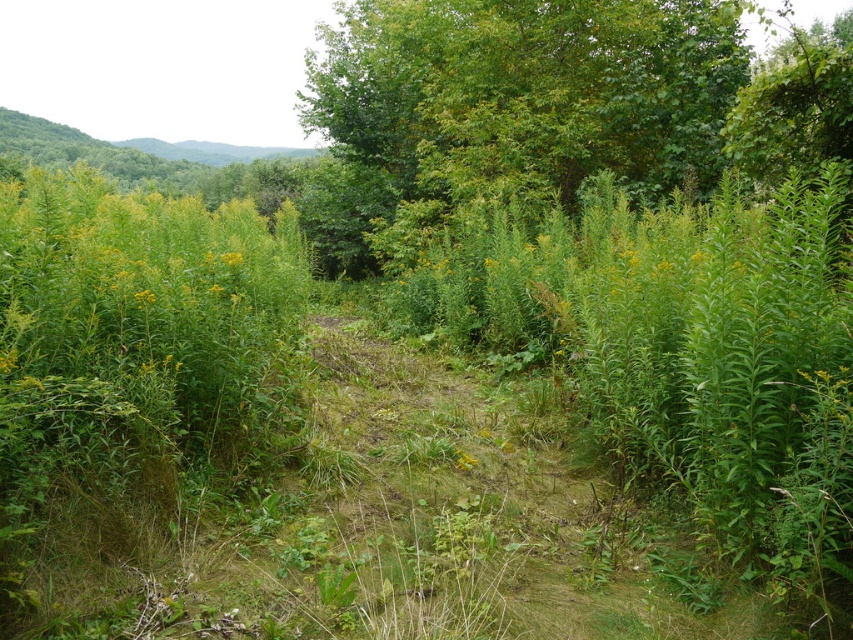
Question: Among these points, which one is farthest from the camera?

Choices:
 (A) (238, 253)
 (B) (143, 292)
 (C) (460, 467)

Answer: (A)

Question: Which point is farther to the camera?

Choices:
 (A) green leafy tree at upper center
 (B) yellow matte flower at center

Answer: (A)

Question: Is green leafy tree at upper center positioned behind yellow-green leafy plant at center?

Choices:
 (A) yes
 (B) no

Answer: (A)

Question: Can you confirm if yellow matte flower at center-left is thinner than yellow-green leafy plant at center?

Choices:
 (A) no
 (B) yes

Answer: (B)

Question: Which point is farther to the camera?

Choices:
 (A) (634, 186)
 (B) (143, 289)
 (C) (461, 461)
 (D) (222, 257)

Answer: (A)

Question: Does yellow matte flower at center appear on the left side of yellow-green leafy plant at center?

Choices:
 (A) yes
 (B) no

Answer: (B)